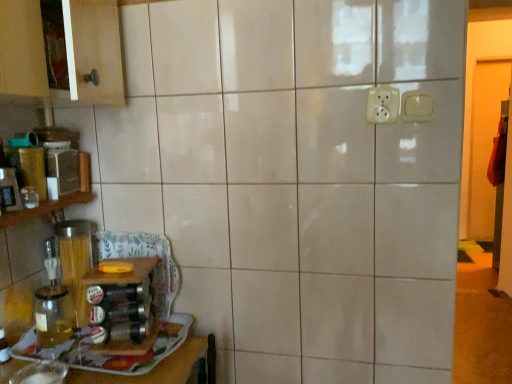
Question: Considering the positions of matte plastic container at left and transparent glass jar at lower left in the image, is matte plastic container at left taller or shorter than transparent glass jar at lower left?

Choices:
 (A) tall
 (B) short

Answer: (A)

Question: Is matte plastic container at left in front of or behind transparent glass jar at lower left in the image?

Choices:
 (A) front
 (B) behind

Answer: (B)

Question: Estimate the real-world distances between objects in this image. Which object is closer to the wooden shelf at left?

Choices:
 (A) matte plastic container at left
 (B) transparent glass jar at lower left
 (C) white plastic electric outlet at upper center, which ranks as the second electric outlet in right-to-left order
 (D) transparent glass jar at left
 (E) white plastic switch at upper right, which is the first electric outlet from right to left

Answer: (A)

Question: Which object is the farthest from the transparent glass jar at left?

Choices:
 (A) transparent glass jar at lower left
 (B) wooden shelf at left
 (C) matte plastic container at left
 (D) white plastic electric outlet at upper center, which ranks as the second electric outlet in right-to-left order
 (E) white plastic switch at upper right, which is the first electric outlet from right to left

Answer: (E)